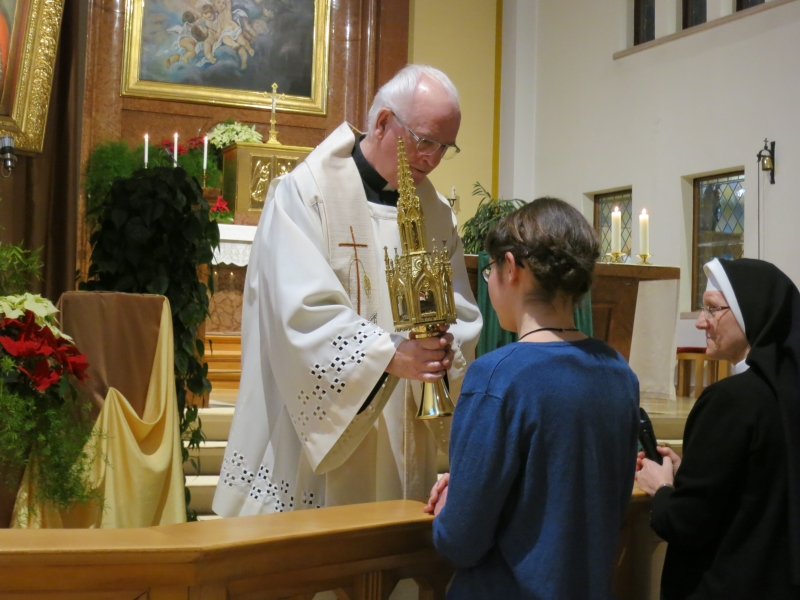
At what (x,y) coordinates should I click in order to perform the action: click on stairs. Please return your answer as a coordinate pair (x, y). This screenshot has height=600, width=800. Looking at the image, I should click on pos(217,424), pos(224,350).